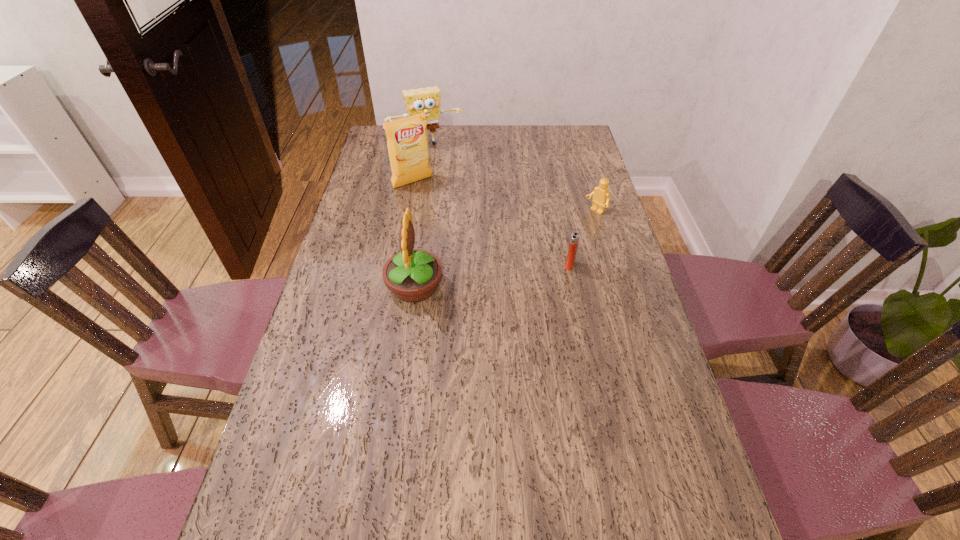
Where is `free space on the desktop that is between the sunflower and the igniter and is positioned on the face of the farthest object`? The width and height of the screenshot is (960, 540). free space on the desktop that is between the sunflower and the igniter and is positioned on the face of the farthest object is located at coordinates (484, 276).

Where is `free space on the desktop that is between the sunflower and the fourth object from left to right and is positioned on the face of the rightmost object`? This screenshot has height=540, width=960. free space on the desktop that is between the sunflower and the fourth object from left to right and is positioned on the face of the rightmost object is located at coordinates (504, 274).

Locate an element on the screen. The height and width of the screenshot is (540, 960). vacant space on the desktop that is between the sunflower and the second object from right to left and is positioned on the front of the fourth nearest object with the logo is located at coordinates (494, 275).